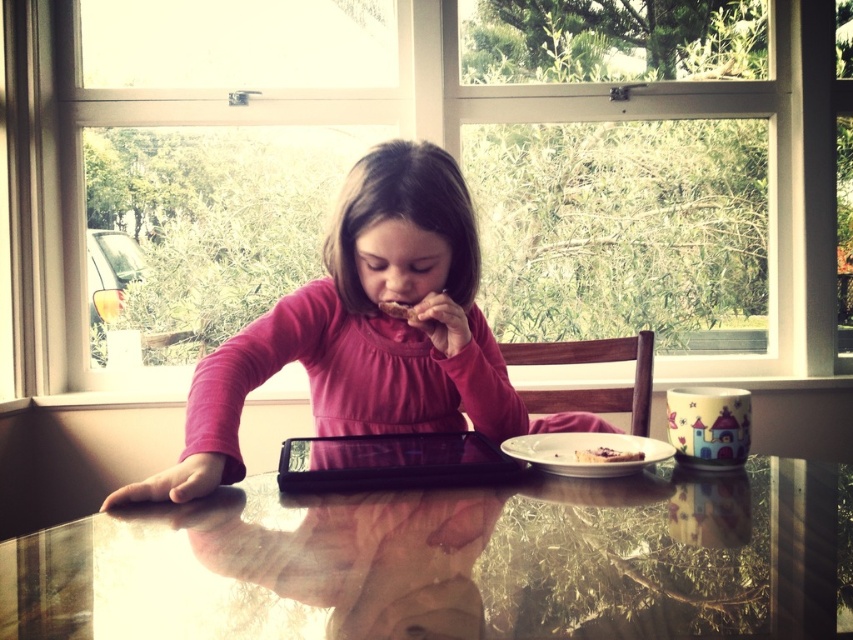
Is white glossy plate at center further to camera compared to brown crumbly snack at center?

No, white glossy plate at center is in front of brown crumbly snack at center.

Based on the photo, is white glossy plate at center shorter than brown crumbly snack at center?

No, white glossy plate at center is not shorter than brown crumbly snack at center.

What are the coordinates of `white glossy plate at center` in the screenshot? It's located at (583, 449).

The height and width of the screenshot is (640, 853). I want to click on white glossy plate at center, so click(x=583, y=449).

Is smooth chocolate cake at center smaller than brown crumbly snack at center?

No, smooth chocolate cake at center is not smaller than brown crumbly snack at center.

Based on the photo, which of these two, smooth chocolate cake at center or brown crumbly snack at center, stands shorter?

smooth chocolate cake at center is shorter.

This screenshot has height=640, width=853. I want to click on smooth chocolate cake at center, so click(606, 456).

Who is lower down, black glossy tablet at center or white glossy plate at center?

black glossy tablet at center

Is point (409, 465) positioned after point (614, 449)?

No.

Between point (289, 451) and point (550, 445), which one is positioned in front?

Point (550, 445) is in front.

The height and width of the screenshot is (640, 853). Identify the location of black glossy tablet at center. (392, 461).